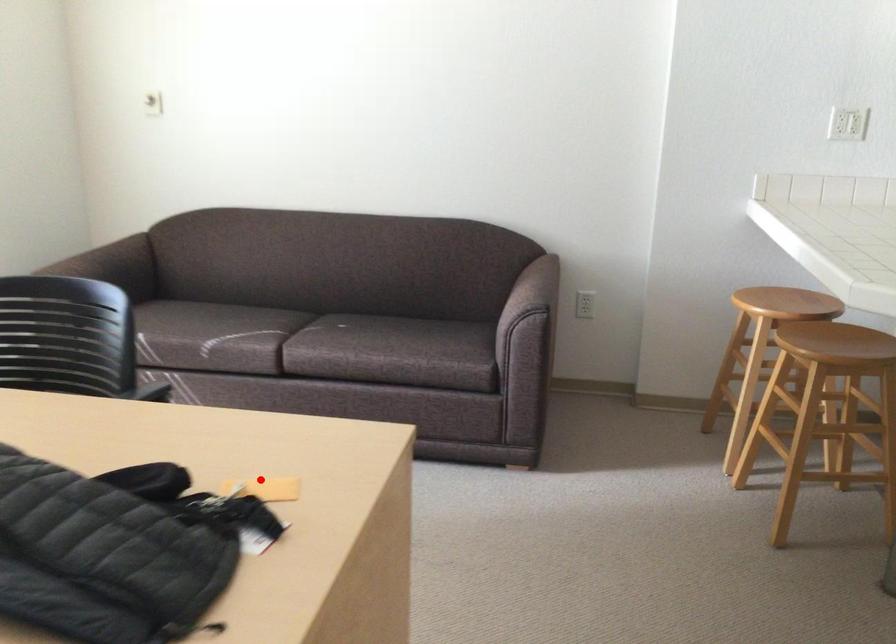
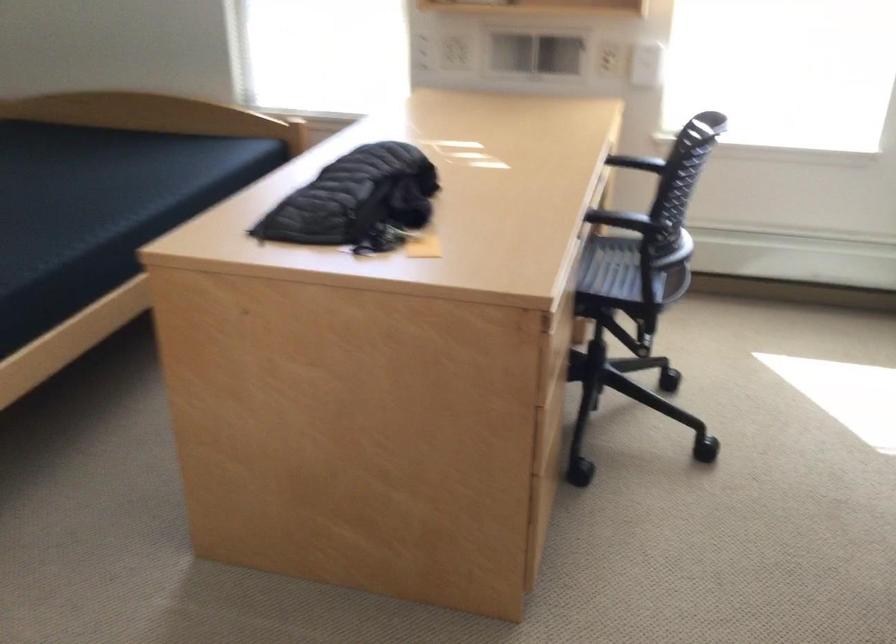
Find the pixel in the second image that matches the highlighted location in the first image.

(421, 245)